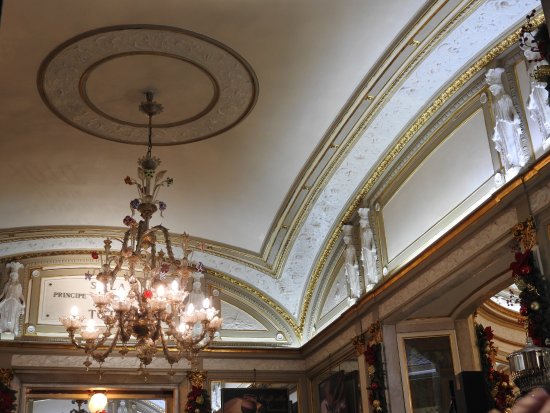
What are the coordinates of `chandelier` in the screenshot? It's located at (145, 310).